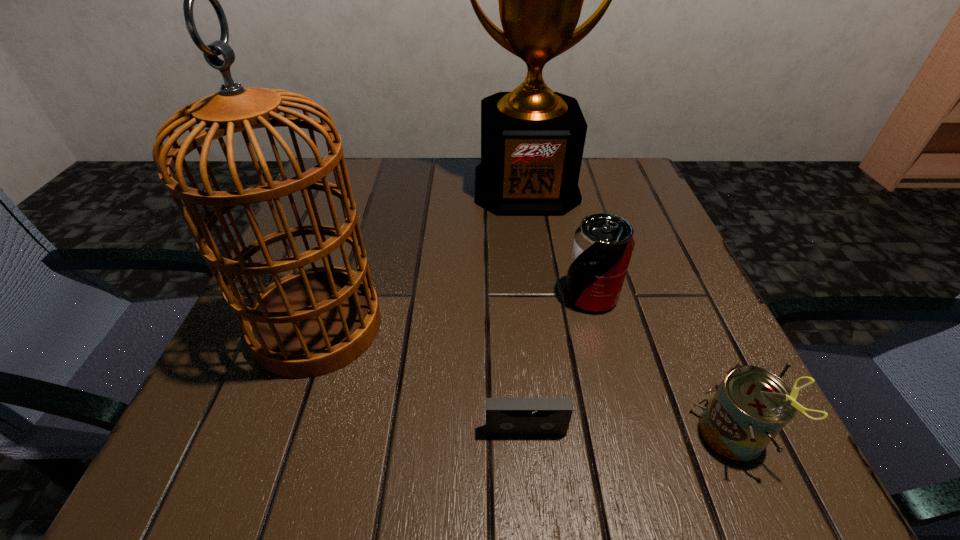
Locate an element on the screen. The height and width of the screenshot is (540, 960). the farthest object is located at coordinates (532, 139).

Where is `birdcage`? birdcage is located at coordinates (312, 322).

Where is `soda can`? This screenshot has width=960, height=540. soda can is located at coordinates (602, 247).

I want to click on can, so click(751, 405).

Locate an element on the screen. The image size is (960, 540). videotape is located at coordinates (504, 416).

I want to click on free point located 0.210m on the front of the trophy cup with the label, so click(540, 284).

In order to click on vacant space situated on the right of the birdcage in this screenshot , I will do `click(503, 326)`.

This screenshot has width=960, height=540. Identify the location of free spot located 0.210m on the left of the soda can. (444, 295).

Identify the location of vacant area located 0.200m on the left of the can. Image resolution: width=960 pixels, height=540 pixels. (546, 435).

Locate an element on the screen. The width and height of the screenshot is (960, 540). free region located on the front-facing side of the videotape is located at coordinates (530, 483).